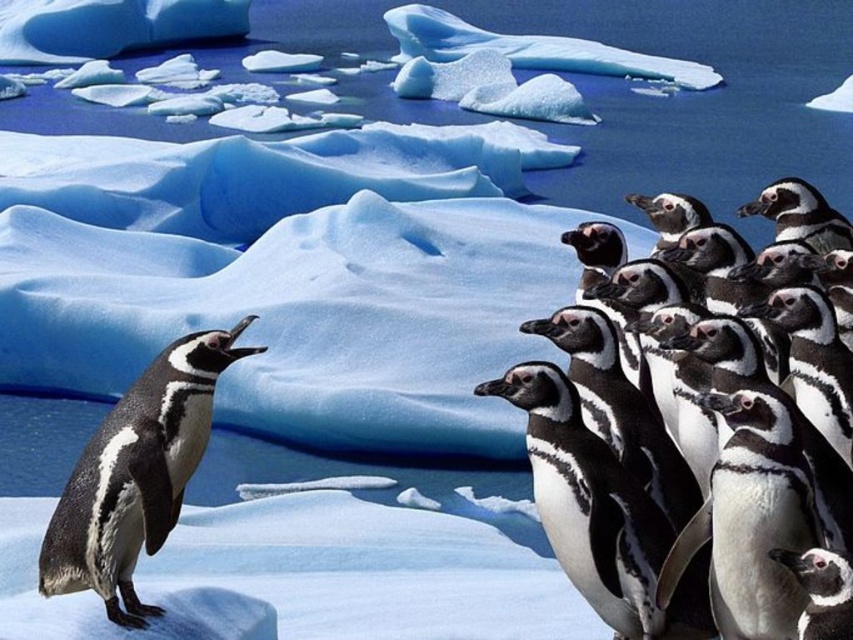
Question: Which object appears closest to the camera in this image?

Choices:
 (A) translucent ice at upper center
 (B) black matte penguin at lower right
 (C) black glossy penguin at left
 (D) black glossy penguin at center

Answer: (B)

Question: Which point is closer to the camera?

Choices:
 (A) black glossy penguin at left
 (B) black glossy penguin at center

Answer: (A)

Question: Can you confirm if black matte penguin at right is bigger than black matte penguin at lower right?

Choices:
 (A) no
 (B) yes

Answer: (B)

Question: Does black matte penguin at right appear over black glossy penguin at center?

Choices:
 (A) no
 (B) yes

Answer: (B)

Question: Which object is farther from the camera taking this photo?

Choices:
 (A) black matte penguin at lower right
 (B) translucent ice at upper center
 (C) black glossy penguin at left
 (D) black glossy penguin at center

Answer: (B)

Question: Does black matte penguin at right appear on the right side of black glossy penguin at center?

Choices:
 (A) no
 (B) yes

Answer: (B)